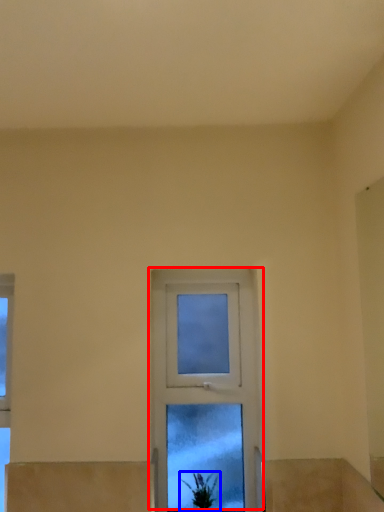
Question: Which object appears closest to the camera in this image, window (highlighted by a red box) or houseplant (highlighted by a blue box)?

Choices:
 (A) window
 (B) houseplant

Answer: (B)